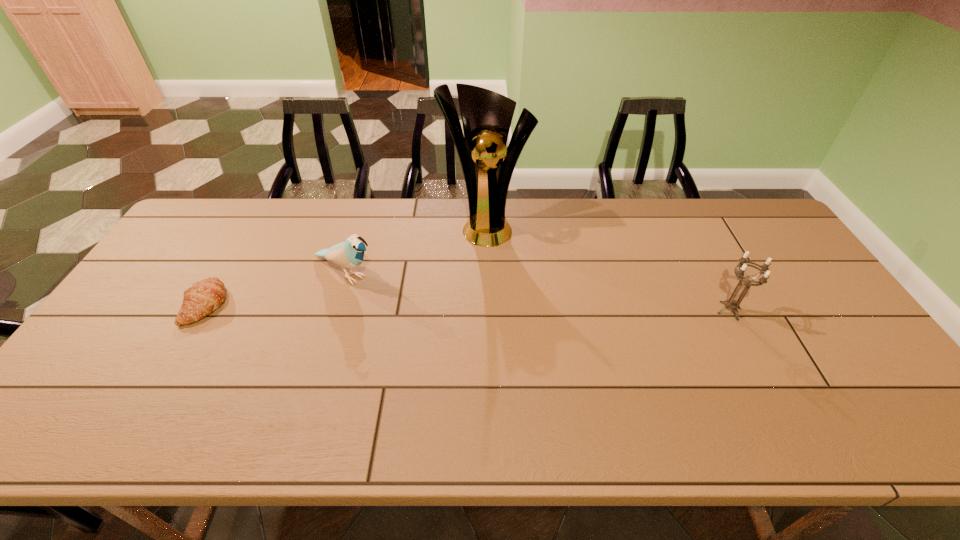
In the image, there is a desktop. At what (x,y) coordinates should I click in order to perform the action: click on vacant space at the far left corner. Please return your answer as a coordinate pair (x, y). Looking at the image, I should click on (185, 235).

Locate an element on the screen. vacant space at the near left corner of the desktop is located at coordinates (115, 372).

Where is `vacant space at the far right corner`? The height and width of the screenshot is (540, 960). vacant space at the far right corner is located at coordinates (751, 207).

What are the coordinates of `vacant area that lies between the bird and the shortest object` in the screenshot? It's located at (276, 289).

Identify the location of free spot between the candle holder and the leftmost object. The image size is (960, 540). (468, 308).

Find the location of a particular element. free area in between the shortest object and the candle holder is located at coordinates (468, 308).

The image size is (960, 540). What are the coordinates of `vacant area that lies between the bird and the leftmost object` in the screenshot? It's located at (276, 289).

This screenshot has height=540, width=960. I want to click on free area in between the bird and the second object from right to left, so click(416, 249).

Locate an element on the screen. free space between the bird and the farthest object is located at coordinates (416, 249).

Locate an element on the screen. The width and height of the screenshot is (960, 540). unoccupied area between the bird and the award is located at coordinates (416, 249).